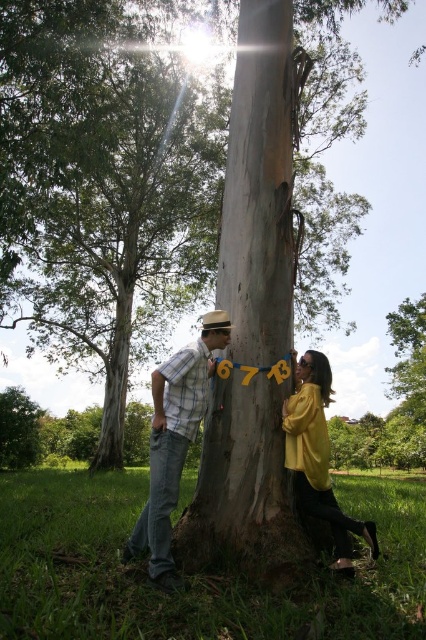
Does plaid shirt at center have a lesser height compared to yellow matte jacket at center?

Incorrect, plaid shirt at center's height does not fall short of yellow matte jacket at center's.

What do you see at coordinates (173, 442) in the screenshot? This screenshot has width=426, height=640. I see `plaid shirt at center` at bounding box center [173, 442].

Is point (198, 378) less distant than point (334, 509)?

Yes, it is.

The width and height of the screenshot is (426, 640). Identify the location of plaid shirt at center. (173, 442).

Is point (348, 561) positioned after point (374, 337)?

No, (348, 561) is closer to viewer.

At what (x,y) coordinates should I click in order to perform the action: click on yellow matte jacket at center. Please return your answer as a coordinate pair (x, y). The height and width of the screenshot is (640, 426). Looking at the image, I should click on coord(317,458).

Where is `yellow matte jacket at center`? yellow matte jacket at center is located at coordinates (317, 458).

The width and height of the screenshot is (426, 640). Describe the element at coordinates (173, 442) in the screenshot. I see `plaid shirt at center` at that location.

Looking at this image, which of these two, plaid shirt at center or smooth gray bark at center, stands taller?

Standing taller between the two is smooth gray bark at center.

Which is behind, point (206, 346) or point (403, 285)?

Point (403, 285)

You are a GUI agent. You are given a task and a screenshot of the screen. Output one action in this format:
    pyautogui.click(x=<x>, y=<y>)
    Task: Click on the plaid shirt at center
    The height and width of the screenshot is (640, 426).
    Given the screenshot: What is the action you would take?
    pyautogui.click(x=173, y=442)